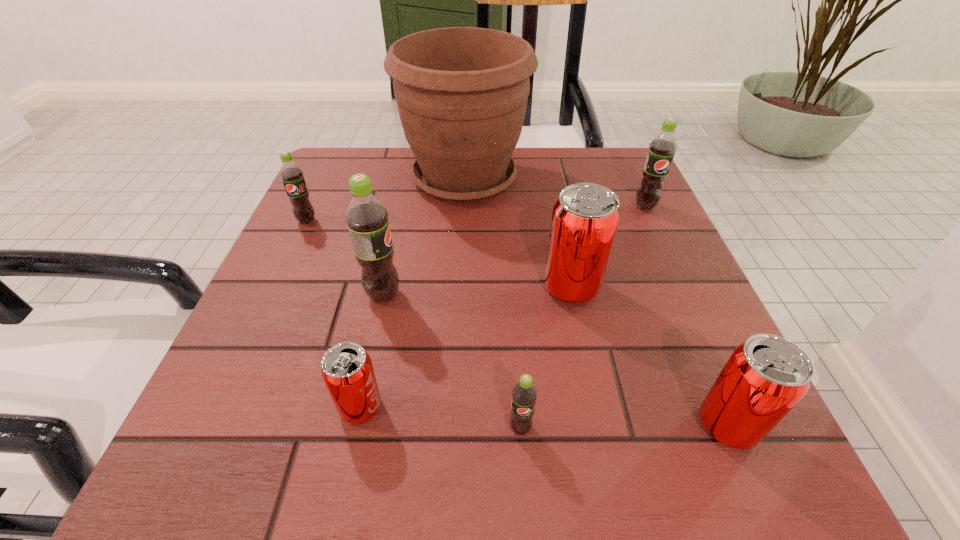
Where is `the third closest object to the biggest red soda can`? Image resolution: width=960 pixels, height=540 pixels. the third closest object to the biggest red soda can is located at coordinates (524, 394).

Locate which soda is the sixth closest to the smallest red soda can. Please provide its 2D coordinates. Your answer should be formatted as a tuple, i.e. [(x, y)], where the tuple contains the x and y coordinates of a point satisfying the conditions above.

[(662, 148)]

Locate an element on the screen. The height and width of the screenshot is (540, 960). soda that is the closest one to the second tallest object is located at coordinates (347, 370).

Identify which green soda is the third closest to the farthest soda. Please provide its 2D coordinates. Your answer should be formatted as a tuple, i.e. [(x, y)], where the tuple contains the x and y coordinates of a point satisfying the conditions above.

[(291, 174)]

Where is `green soda that stands as the closest to the nearest green soda`? Image resolution: width=960 pixels, height=540 pixels. green soda that stands as the closest to the nearest green soda is located at coordinates (366, 216).

At what (x,y) coordinates should I click in order to perform the action: click on the second closest red soda can to the seventh shortest object. Please return your answer as a coordinate pair (x, y). Looking at the image, I should click on (585, 218).

Point out which red soda can is positioned as the second nearest to the third green soda from right to left. Please provide its 2D coordinates. Your answer should be formatted as a tuple, i.e. [(x, y)], where the tuple contains the x and y coordinates of a point satisfying the conditions above.

[(585, 218)]

Locate an element on the screen. The height and width of the screenshot is (540, 960). vacant point that satisfies the following two spatial constraints: 1. on the front label of the farthest soda; 2. on the front label of the third farthest green soda is located at coordinates (686, 295).

This screenshot has width=960, height=540. In order to click on free spot that satisfies the following two spatial constraints: 1. on the front label of the second smallest green soda; 2. on the left side of the rightmost red soda can in this screenshot , I will do `click(211, 425)`.

Identify the location of free space in the image that satisfies the following two spatial constraints: 1. on the front label of the biggest red soda can; 2. on the left side of the second farthest green soda. (276, 288).